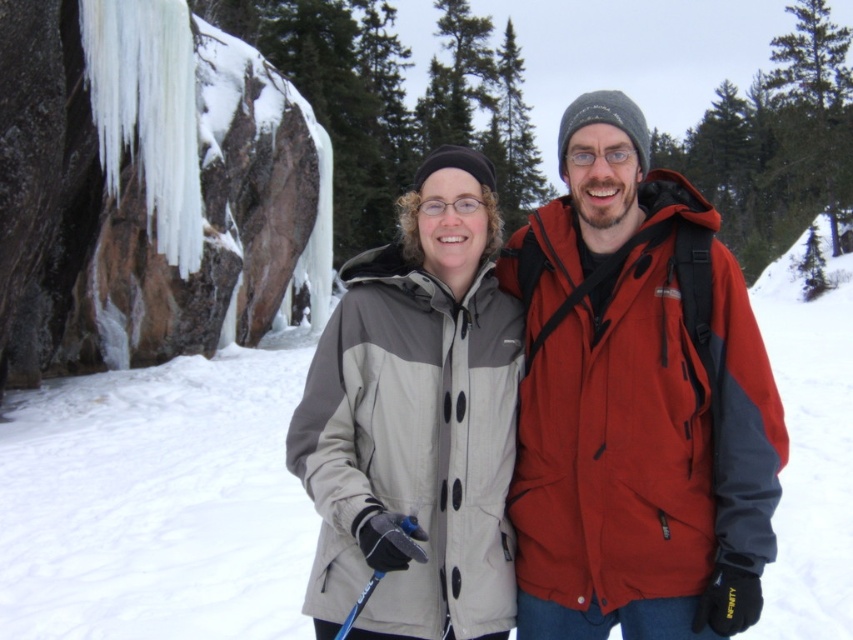
Question: Which point is closer to the camera?

Choices:
 (A) [366, 588]
 (B) [819, 419]

Answer: (A)

Question: Can you confirm if matte red jacket at center is wider than gray matte jacket at center?

Choices:
 (A) no
 (B) yes

Answer: (B)

Question: Is matte red jacket at center bigger than white fluffy snow at center?

Choices:
 (A) yes
 (B) no

Answer: (B)

Question: Does matte red jacket at center have a greater width compared to blue plastic ski pole at lower center?

Choices:
 (A) no
 (B) yes

Answer: (B)

Question: Based on their relative distances, which object is farther from the matte red jacket at center?

Choices:
 (A) white fluffy snow at center
 (B) gray matte jacket at center

Answer: (A)

Question: Which point is closer to the camera?

Choices:
 (A) (355, 612)
 (B) (76, 593)
 (C) (550, 392)
 (D) (410, 460)

Answer: (A)